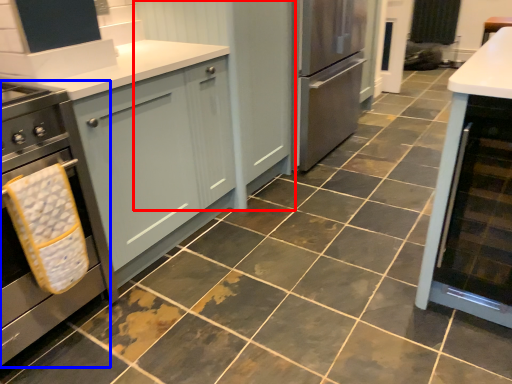
Question: Which of the following is the closest to the observer, cabinetry (highlighted by a red box) or home appliance (highlighted by a blue box)?

Choices:
 (A) cabinetry
 (B) home appliance

Answer: (B)